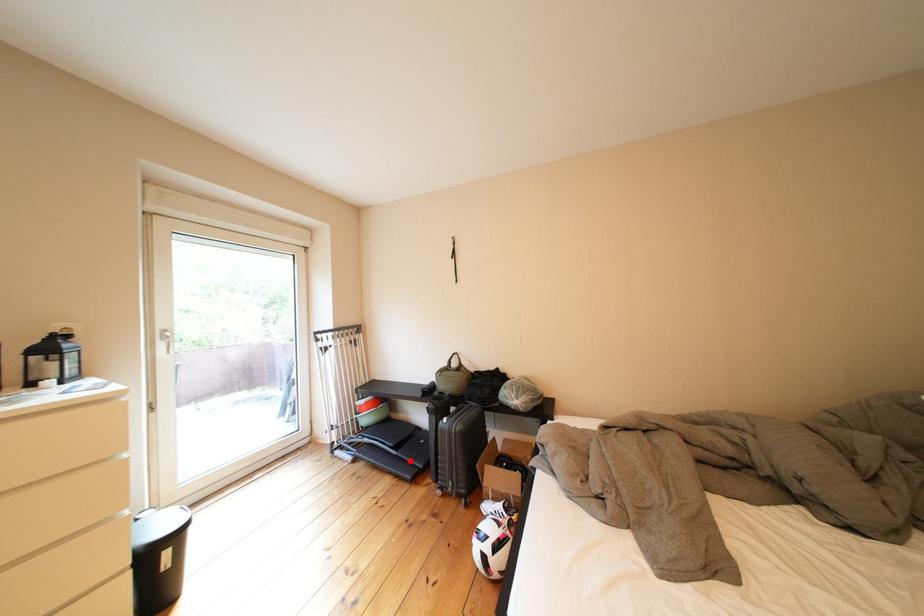
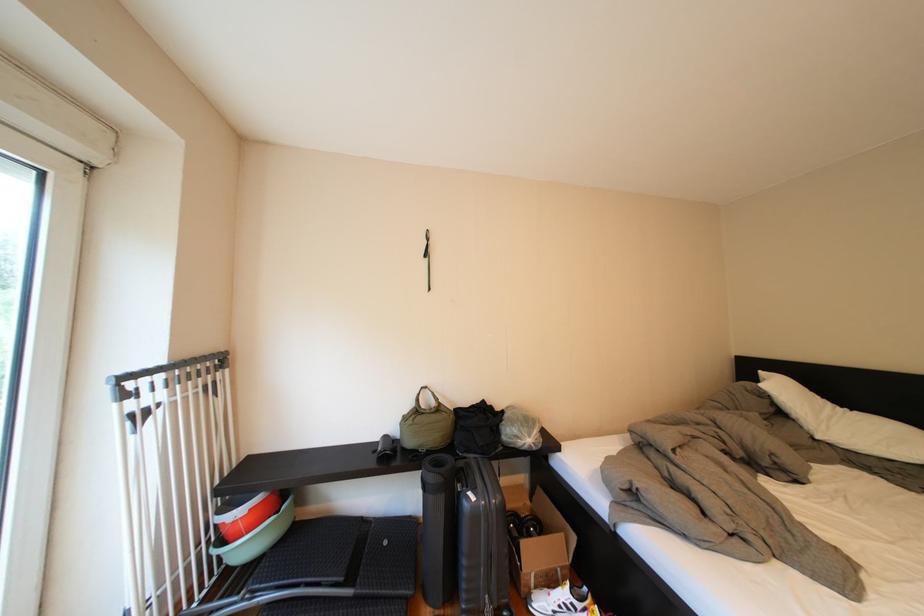
Question: I am providing you with two images of the same scene from different viewpoints. In image1, a red point is highlighted. Considering the same 3D point in image2, which of the following is correct?

Choices:
 (A) It is closer
 (B) It is farther

Answer: (A)